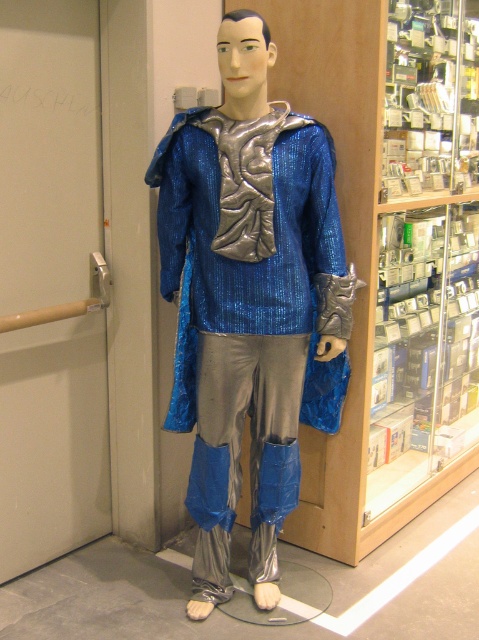
You are a fashion designer who wants to photograph the shiny metallic suit at center and the clear glass display case at center right. To ensure both are in the frame, where should you position the camera relative to the mannequin?

The shiny metallic suit at center is below the clear glass display case at center right, so positioning the camera slightly above the mannequin would allow both the shiny metallic suit at center and the clear glass display case at center right to be captured in the frame.

You are an interior designer assessing the placement of two points in the image. The first point is at coordinate point (193, 109) and the second is at point (422, 193). Which point is nearer to you as you view the image?

Point (193, 109) is closer to the viewer than point (422, 193).